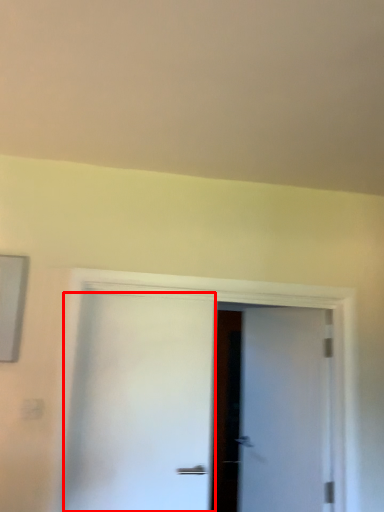
Question: From the image's perspective, where is door (annotated by the red box) located relative to door?

Choices:
 (A) below
 (B) above

Answer: (B)